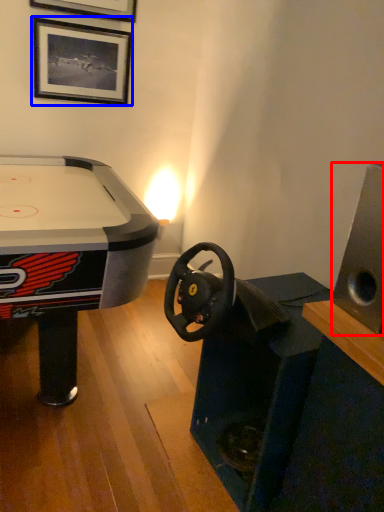
Question: Which of the following is the closest to the observer, speaker (highlighted by a red box) or picture frame (highlighted by a blue box)?

Choices:
 (A) speaker
 (B) picture frame

Answer: (A)